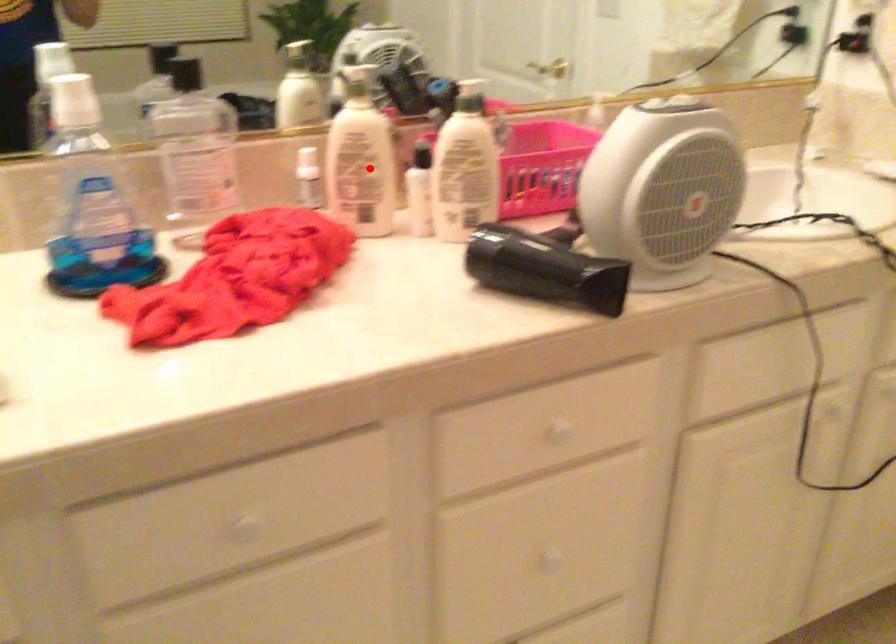
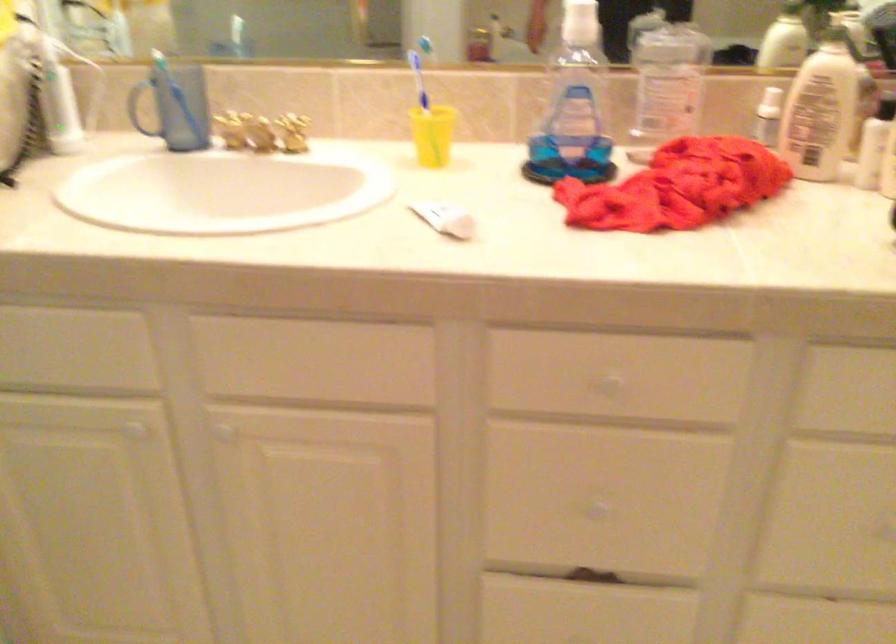
The point at the highlighted location is marked in the first image. Where is the corresponding point in the second image?

(821, 109)